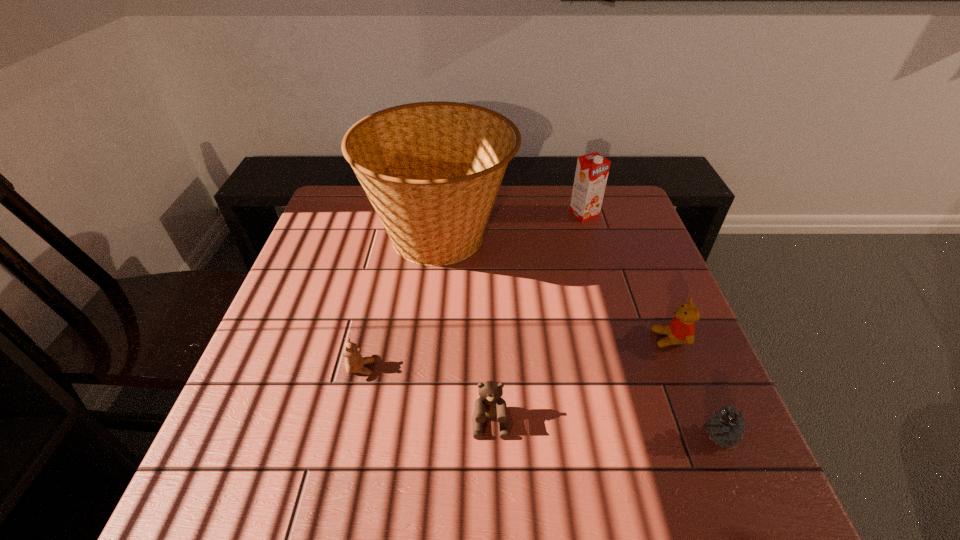
The width and height of the screenshot is (960, 540). I want to click on vacant space situated on the front-facing side of the rightmost teddy bear, so (531, 339).

Image resolution: width=960 pixels, height=540 pixels. I want to click on vacant space located 0.280m on the front-facing side of the rightmost teddy bear, so click(531, 339).

The width and height of the screenshot is (960, 540). In order to click on free spot located on the face of the second teddy bear from left to right in this screenshot , I will do `click(492, 490)`.

Image resolution: width=960 pixels, height=540 pixels. Identify the location of free space located on the face of the shortest teddy bear. (508, 368).

Where is `free space located 0.290m on the left of the pinecone`? free space located 0.290m on the left of the pinecone is located at coordinates (552, 435).

Locate an element on the screen. This screenshot has width=960, height=540. basket located at the far edge is located at coordinates click(x=432, y=170).

Identify the location of carton located at the far edge. Image resolution: width=960 pixels, height=540 pixels. (592, 169).

Identify the location of object present at the left edge. (432, 170).

Image resolution: width=960 pixels, height=540 pixels. Find the location of `carton located in the right edge section of the desktop`. carton located in the right edge section of the desktop is located at coordinates (592, 169).

At what (x,y) coordinates should I click in order to perform the action: click on teddy bear positioned at the right edge. Please return your answer as a coordinate pair (x, y). The height and width of the screenshot is (540, 960). Looking at the image, I should click on (681, 330).